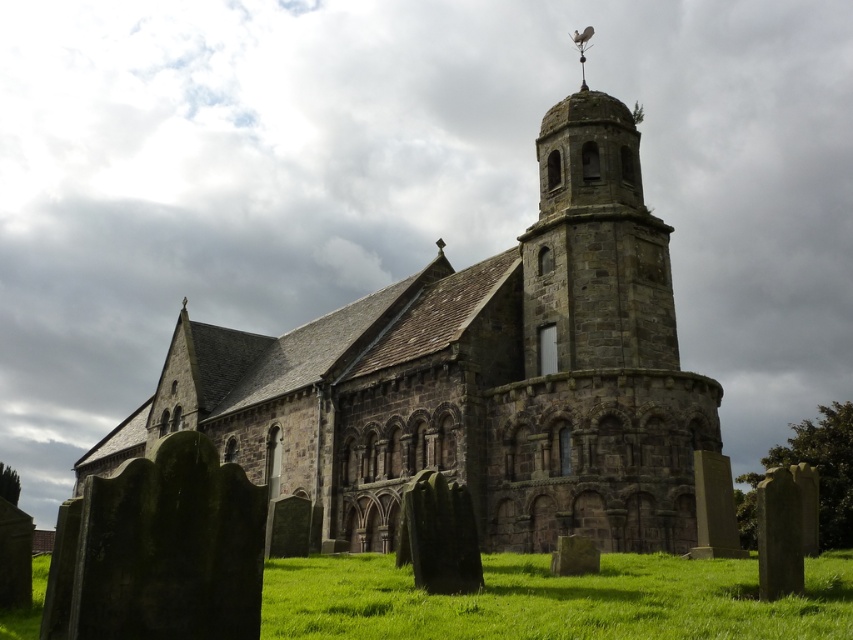
You are standing at the edge of the green grass at lower center and want to take a photo of the brown stone church at center. Which direction should you face to ensure the church is in the frame?

Since the brown stone church at center is to the left of green grass at lower center, you should face to the left to capture the church in your photo.

You are a landscape architect designing a new garden around the brown stone church at center and green grass at lower center. If you want to ensure the garden path is wider than the church, which object should you measure to determine the minimum path width?

The brown stone church at center is wider than the green grass at lower center. Therefore, you should measure the brown stone church at center to determine the minimum path width, as the path needs to be wider than the church.

You are standing at the point marked as point (474, 376). What structure is located exactly at this point?

The brown stone church at center is located exactly at point (474, 376).